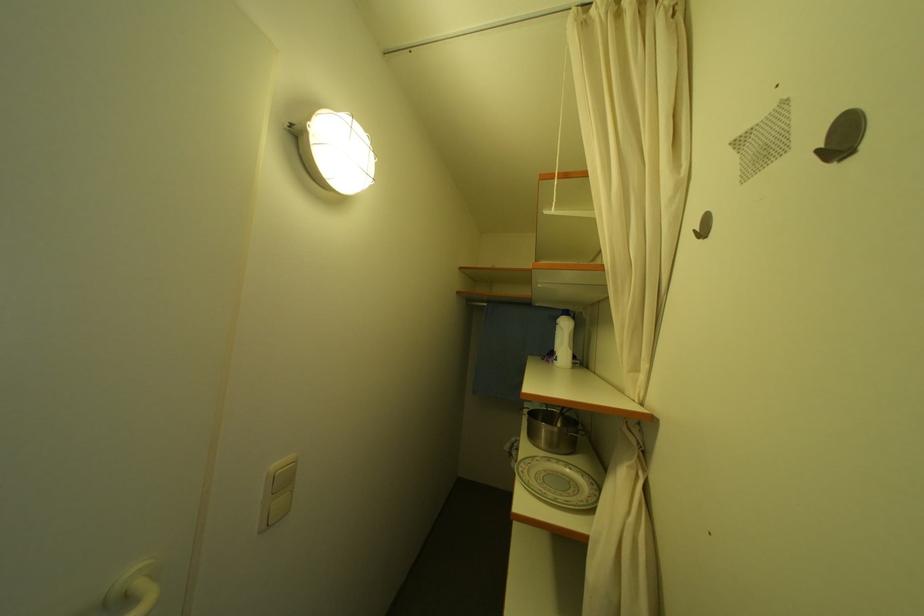
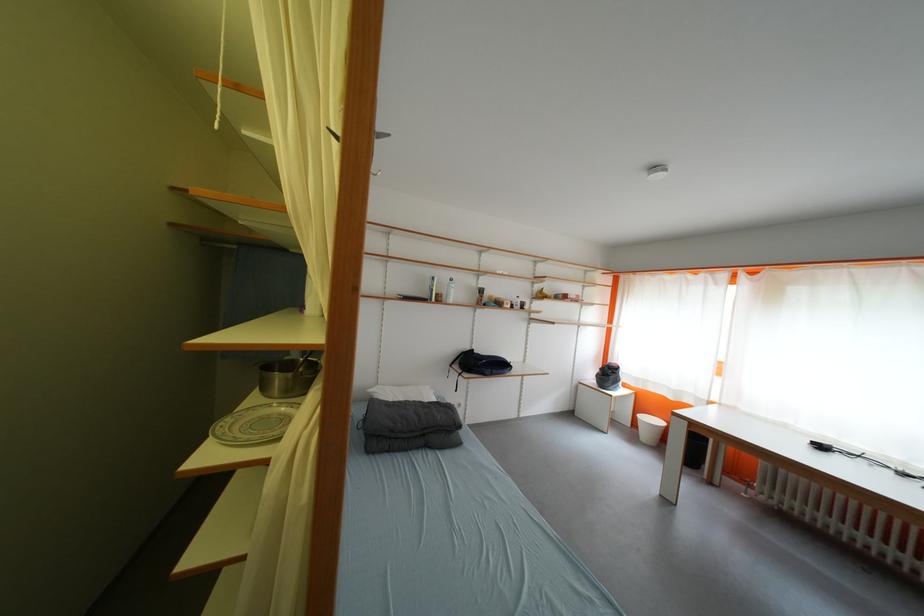
Question: The camera is either moving clockwise (left) or counter-clockwise (right) around the object. The first image is from the beginning of the video and the second image is from the end. Is the camera moving left or right when shooting the video?

Choices:
 (A) Left
 (B) Right

Answer: (A)